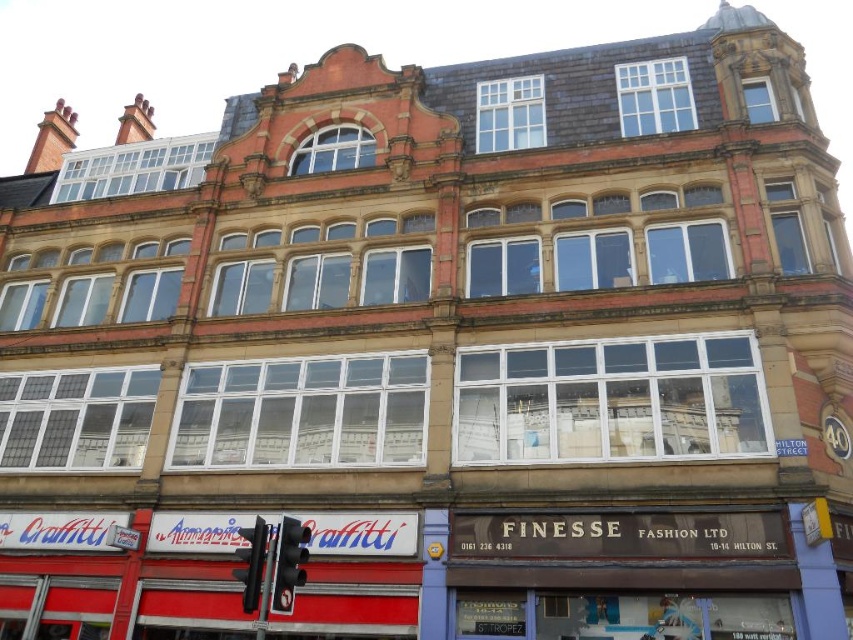
Question: Is black plastic traffic light at lower left closer to camera compared to black plastic traffic light at center?

Choices:
 (A) no
 (B) yes

Answer: (A)

Question: Is black plastic traffic light at lower left wider than black plastic traffic light at center?

Choices:
 (A) no
 (B) yes

Answer: (A)

Question: Which point is farther from the camera taking this photo?

Choices:
 (A) (286, 534)
 (B) (267, 531)

Answer: (B)

Question: Does black plastic traffic light at lower left have a greater width compared to black plastic traffic light at center?

Choices:
 (A) yes
 (B) no

Answer: (B)

Question: Which point is farther from the camera taking this photo?

Choices:
 (A) [299, 524]
 (B) [260, 518]

Answer: (B)